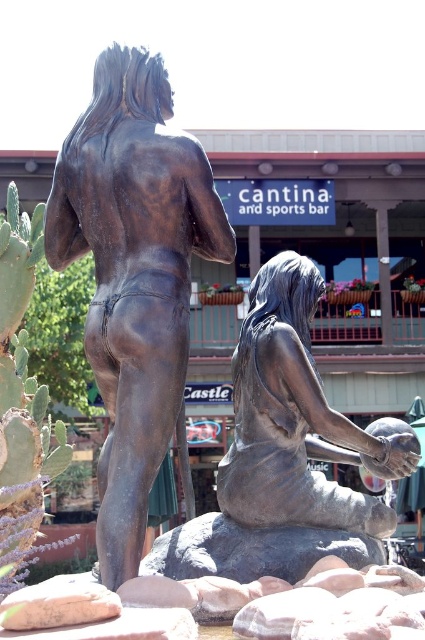
Question: Does bronze statue at left appear over bronze statue at center?

Choices:
 (A) yes
 (B) no

Answer: (A)

Question: Which point appears farthest from the camera in this image?

Choices:
 (A) (280, 269)
 (B) (113, 340)

Answer: (A)

Question: Which point is farther from the camera taking this photo?

Choices:
 (A) (70, 212)
 (B) (401, 464)

Answer: (A)

Question: Does bronze statue at left have a greater width compared to bronze statue at center?

Choices:
 (A) no
 (B) yes

Answer: (B)

Question: In this image, where is bronze statue at left located relative to bronze statue at center?

Choices:
 (A) below
 (B) above

Answer: (B)